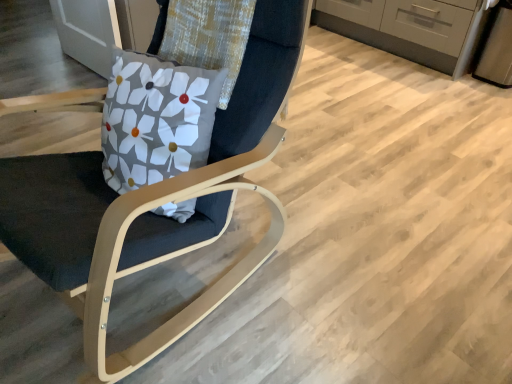
Question: From a real-world perspective, is matte gray cabinetry at upper right located beneath matte wood chair at center?

Choices:
 (A) no
 (B) yes

Answer: (B)

Question: From the image's perspective, is matte gray cabinetry at upper right beneath matte wood chair at center?

Choices:
 (A) no
 (B) yes

Answer: (A)

Question: Is matte gray cabinetry at upper right taller than matte wood chair at center?

Choices:
 (A) no
 (B) yes

Answer: (A)

Question: Are matte gray cabinetry at upper right and matte wood chair at center making contact?

Choices:
 (A) yes
 (B) no

Answer: (B)

Question: Is matte gray cabinetry at upper right oriented away from matte wood chair at center?

Choices:
 (A) yes
 (B) no

Answer: (B)

Question: Is matte gray cabinetry at upper right positioned behind matte wood chair at center?

Choices:
 (A) yes
 (B) no

Answer: (A)

Question: Is matte wood chair at center not inside matte gray cabinetry at upper right?

Choices:
 (A) no
 (B) yes

Answer: (B)

Question: Is matte wood chair at center placed right next to matte gray cabinetry at upper right?

Choices:
 (A) yes
 (B) no

Answer: (B)

Question: From a real-world perspective, is matte wood chair at center below matte gray cabinetry at upper right?

Choices:
 (A) no
 (B) yes

Answer: (A)

Question: Is the position of matte wood chair at center more distant than that of matte gray cabinetry at upper right?

Choices:
 (A) no
 (B) yes

Answer: (A)

Question: Is matte wood chair at center wider than matte gray cabinetry at upper right?

Choices:
 (A) no
 (B) yes

Answer: (B)

Question: From the image's perspective, does matte wood chair at center appear lower than matte gray cabinetry at upper right?

Choices:
 (A) yes
 (B) no

Answer: (A)

Question: From the image's perspective, is matte gray cabinetry at upper right located above or below matte wood chair at center?

Choices:
 (A) below
 (B) above

Answer: (B)